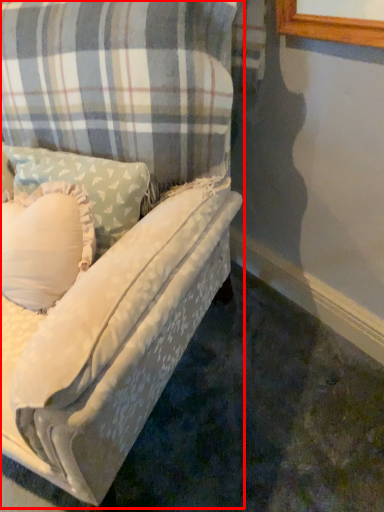
Question: From the image, what is the correct spatial relationship of studio couch (annotated by the red box) in relation to pillow?

Choices:
 (A) right
 (B) left

Answer: (B)